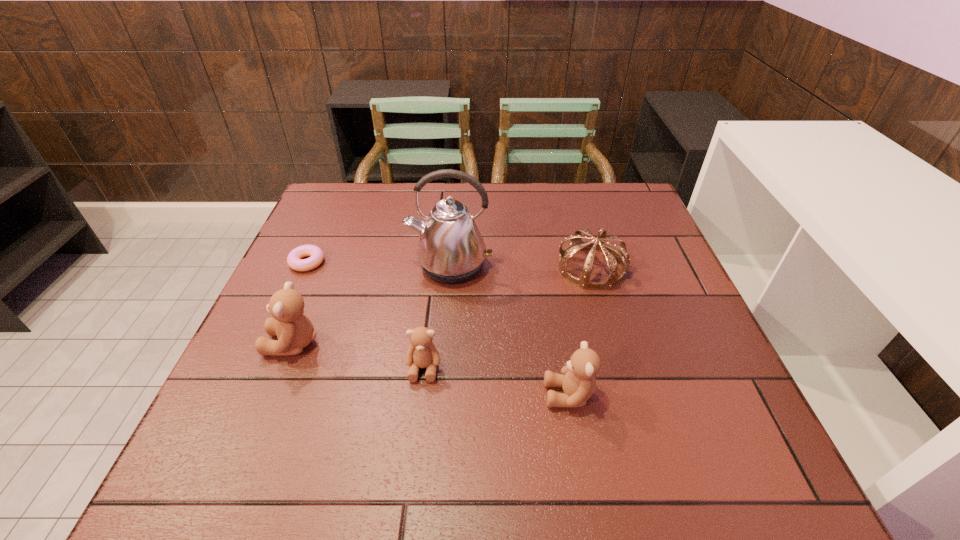
The image size is (960, 540). What are the coordinates of `free space for a new teddy bear on the right` in the screenshot? It's located at pos(732,424).